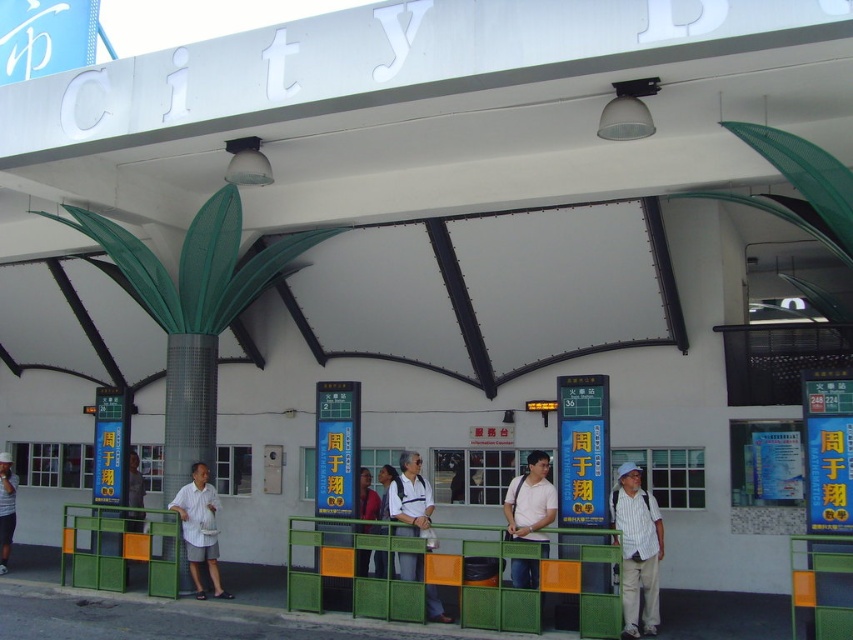
Does light gray cotton shirt at center appear over white fabric shirt at center?

No, light gray cotton shirt at center is not above white fabric shirt at center.

Is light gray cotton shirt at center closer to the viewer compared to white fabric shirt at center?

No.

This screenshot has height=640, width=853. Find the location of `light gray cotton shirt at center`. light gray cotton shirt at center is located at coordinates (199, 529).

Is the position of light gray cotton shirt at center less distant than that of white cotton shirt at center?

Yes, it is in front of white cotton shirt at center.

Is light gray cotton shirt at center smaller than white cotton shirt at center?

No.

What do you see at coordinates (199, 529) in the screenshot? I see `light gray cotton shirt at center` at bounding box center [199, 529].

Find the location of a particular element. This screenshot has height=640, width=853. light gray cotton shirt at center is located at coordinates (199, 529).

Does white striped shirt at center have a greater height compared to white fabric shirt at center?

Yes.

Between white striped shirt at center and white fabric shirt at center, which one is positioned lower?

Positioned lower is white striped shirt at center.

Is point (640, 556) closer to camera compared to point (397, 500)?

Yes, point (640, 556) is closer to viewer.

The height and width of the screenshot is (640, 853). I want to click on white striped shirt at center, so click(x=637, y=550).